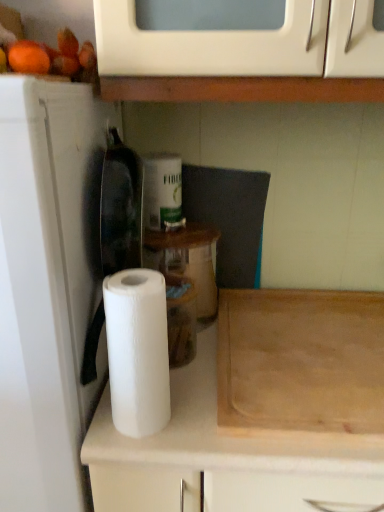
I want to click on free spot above wooden cutting board at lower right (from a real-world perspective), so click(308, 343).